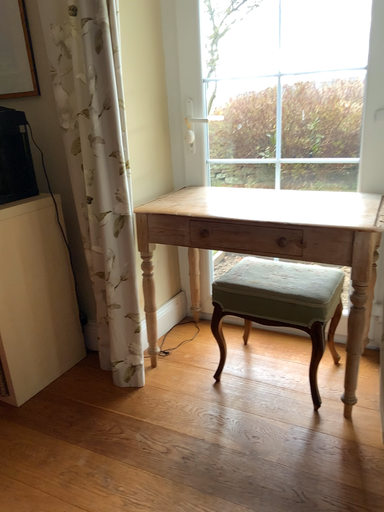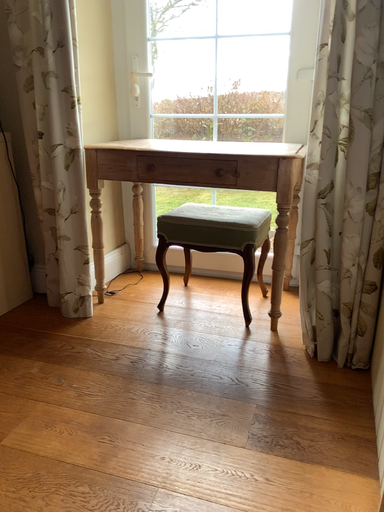
Question: Which way did the camera rotate in the video?

Choices:
 (A) rotated left
 (B) rotated right

Answer: (B)